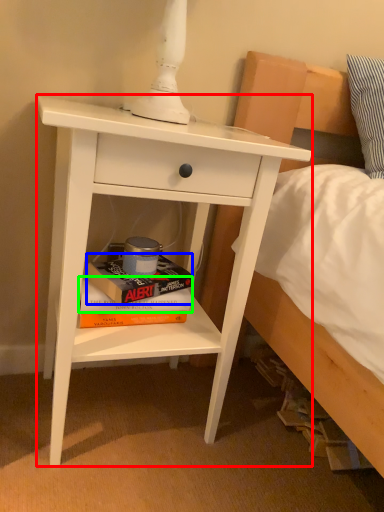
Question: Which is farther away from nightstand (highlighted by a red box)? paperback book (highlighted by a blue box) or paperback book (highlighted by a green box)?

Choices:
 (A) paperback book
 (B) paperback book

Answer: (B)